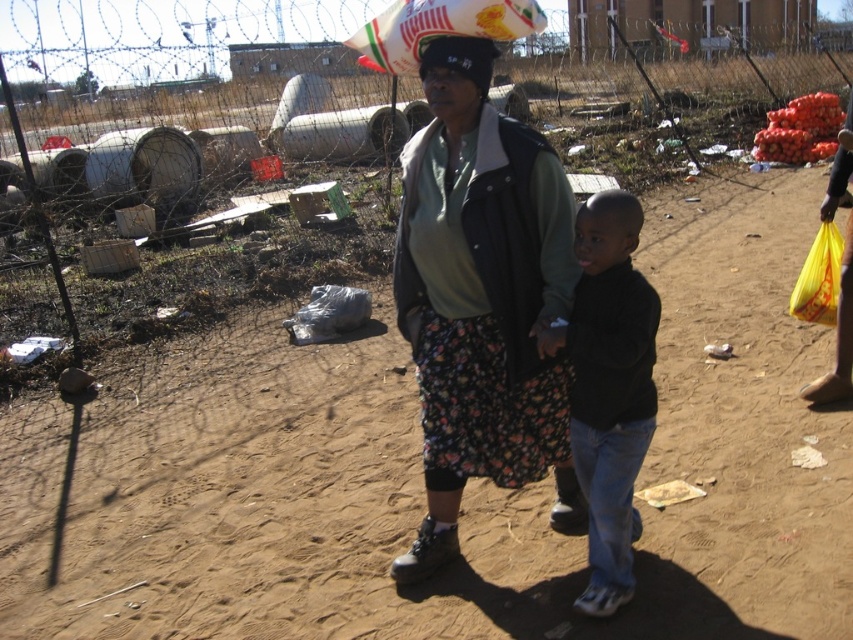
You are a fashion designer observing the two people in the image. You need to determine if the floral fabric skirt at center and the black matte shirt at center can be paired together in a new collection. Considering their distance apart in the image, would they be considered close enough to suggest a possible outfit combination?

The floral fabric skirt at center is 12.29 inches from the black matte shirt at center, which is a close proximity, so yes, they can be paired together in a new collection as they are positioned near each other.

You are standing at the starting point and want to walk to the fence in the background. Which point, point (x=410, y=282) or point (x=604, y=524), is closer to you as you begin your journey?

Point (x=410, y=282) is closer to you because it is further to the viewer than point (x=604, y=524), meaning it is physically nearer to your starting position.